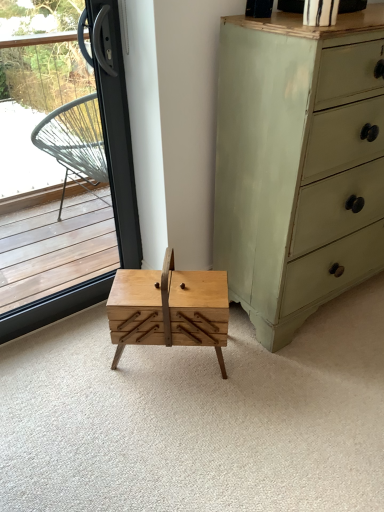
At what (x,y) coordinates should I click in order to perform the action: click on vacant region below natural wood table at center (from a real-world perspective). Please return your answer as a coordinate pair (x, y). The image size is (384, 512). Looking at the image, I should click on (172, 358).